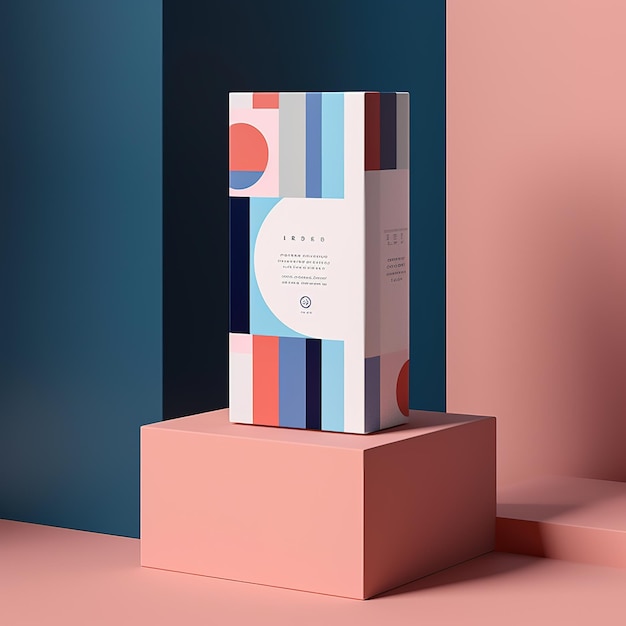
At what (x,y) coordinates should I click in order to perform the action: click on blue wall. Please return your answer as a coordinate pair (x, y). Looking at the image, I should click on (69, 305).